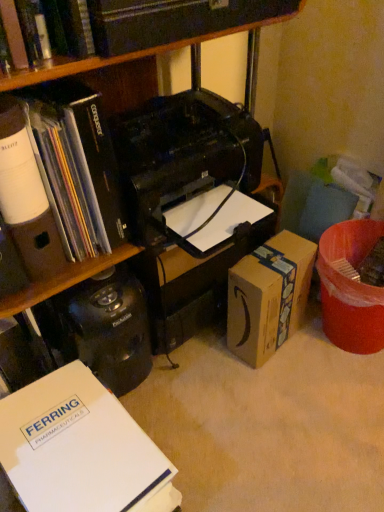
The image size is (384, 512). What are the coordinates of `vacant area that is in front of brown cardboard box at lower right` in the screenshot? It's located at (278, 392).